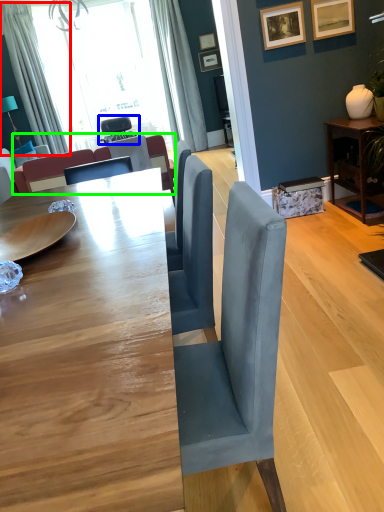
Question: Estimate the real-world distances between objects in this image. Which object is farther from curtain (highlighted by a red box), chair (highlighted by a blue box) or couch (highlighted by a green box)?

Choices:
 (A) chair
 (B) couch

Answer: (B)